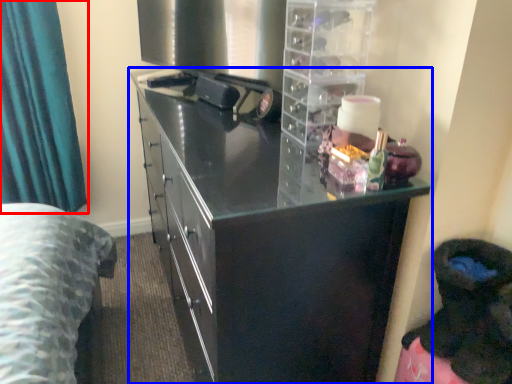
Question: Which object appears closest to the camera in this image, curtain (highlighted by a red box) or cupboard (highlighted by a blue box)?

Choices:
 (A) curtain
 (B) cupboard

Answer: (B)